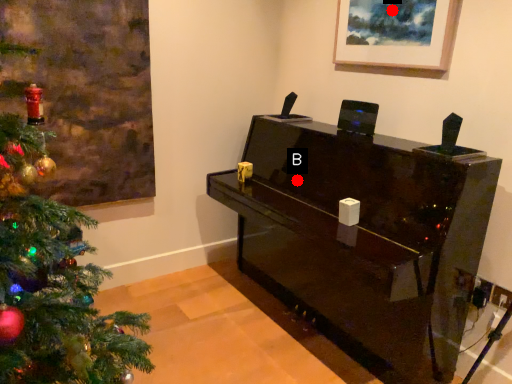
Question: Two points are circled on the image, labeled by A and B beside each circle. Which point is closer to the camera taking this photo?

Choices:
 (A) A is closer
 (B) B is closer

Answer: (A)